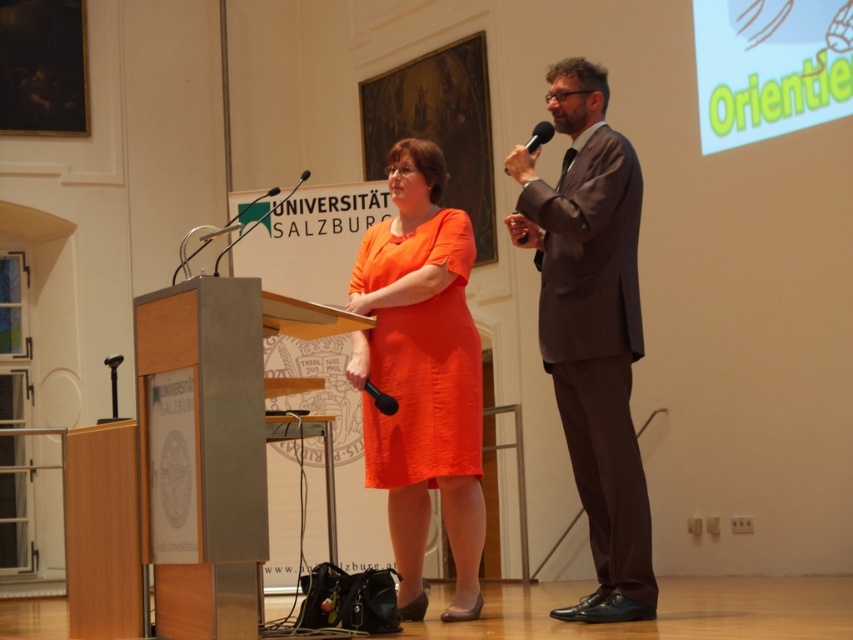
Question: Which point is farther to the camera?

Choices:
 (A) tap(538, 129)
 (B) tap(239, 364)

Answer: (A)

Question: Is metallic silver podium at center positioned in front of dark brown suit at center?

Choices:
 (A) no
 (B) yes

Answer: (B)

Question: From the image, what is the correct spatial relationship of metallic silver podium at center in relation to dark brown suit at center?

Choices:
 (A) above
 (B) below

Answer: (B)

Question: Is dark brown suit at center to the right of orange satin dress at center from the viewer's perspective?

Choices:
 (A) no
 (B) yes

Answer: (B)

Question: Which object appears closest to the camera in this image?

Choices:
 (A) dark brown suit at center
 (B) metallic silver podium at center
 (C) black plastic microphone at upper right
 (D) orange satin dress at center

Answer: (B)

Question: Among these points, which one is farthest from the camera?

Choices:
 (A) (167, 593)
 (B) (453, 321)

Answer: (B)